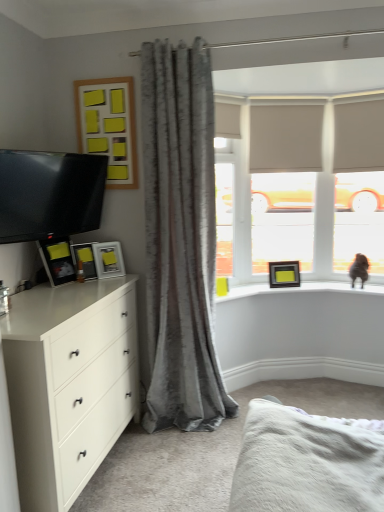
Question: Is matte black picture frame at upper right, arranged as the 1th picture frame when viewed from the back, closer to the viewer compared to brown furry cat at upper right?

Choices:
 (A) yes
 (B) no

Answer: (B)

Question: Considering the relative sizes of matte black picture frame at upper right, which ranks as the 5th picture frame in left-to-right order, and brown furry cat at upper right in the image provided, is matte black picture frame at upper right, which ranks as the 5th picture frame in left-to-right order, smaller than brown furry cat at upper right?

Choices:
 (A) yes
 (B) no

Answer: (A)

Question: Is matte black picture frame at upper right, the 5th picture frame when ordered from top to bottom, at the right side of brown furry cat at upper right?

Choices:
 (A) yes
 (B) no

Answer: (B)

Question: Does matte black picture frame at upper right, arranged as the 1th picture frame when viewed from the back, have a greater height compared to brown furry cat at upper right?

Choices:
 (A) yes
 (B) no

Answer: (B)

Question: Is matte black picture frame at upper right, the first picture frame in the bottom-to-top sequence, oriented towards brown furry cat at upper right?

Choices:
 (A) no
 (B) yes

Answer: (A)

Question: Relative to beige fabric blind at upper center, is matte black tv at left in front or behind?

Choices:
 (A) behind
 (B) front

Answer: (B)

Question: Considering the positions of matte black tv at left and beige fabric blind at upper center in the image, is matte black tv at left taller or shorter than beige fabric blind at upper center?

Choices:
 (A) tall
 (B) short

Answer: (B)

Question: Would you say matte black tv at left is to the left or to the right of beige fabric blind at upper center in the picture?

Choices:
 (A) right
 (B) left

Answer: (B)

Question: Based on their sizes in the image, would you say matte black tv at left is bigger or smaller than beige fabric blind at upper center?

Choices:
 (A) big
 (B) small

Answer: (A)

Question: Looking at their shapes, would you say matte black tv at left is wider or thinner than wooden frame with yellow sticky notes at upper left, which ranks as the 4th picture frame in back-to-front order?

Choices:
 (A) wide
 (B) thin

Answer: (A)

Question: Is matte black tv at left inside or outside of wooden frame with yellow sticky notes at upper left, marked as the 2th picture frame in a front-to-back arrangement?

Choices:
 (A) inside
 (B) outside

Answer: (B)

Question: Is matte black tv at left to the left or to the right of wooden frame with yellow sticky notes at upper left, acting as the fifth picture frame starting from the bottom, in the image?

Choices:
 (A) left
 (B) right

Answer: (A)

Question: Looking at the image, does matte black tv at left seem bigger or smaller compared to wooden frame with yellow sticky notes at upper left, marked as the 2th picture frame in a front-to-back arrangement?

Choices:
 (A) big
 (B) small

Answer: (A)

Question: Considering their positions, is beige fabric blind at upper center located in front of or behind beige fabric window frame at upper center?

Choices:
 (A) behind
 (B) front

Answer: (B)

Question: In terms of size, does beige fabric blind at upper center appear bigger or smaller than beige fabric window frame at upper center?

Choices:
 (A) big
 (B) small

Answer: (B)